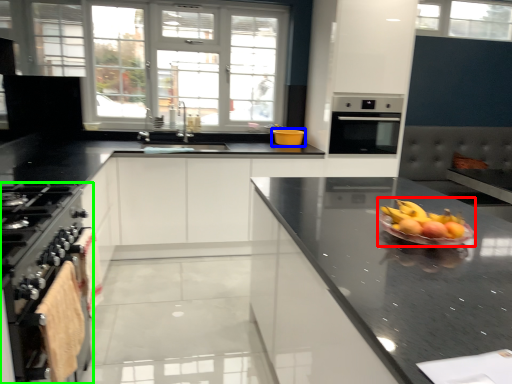
Question: Based on their relative distances, which object is farther from fruit salad (highlighted by a red box)? Choose from glass bowl (highlighted by a blue box) and kitchen appliance (highlighted by a green box).

Choices:
 (A) glass bowl
 (B) kitchen appliance

Answer: (A)